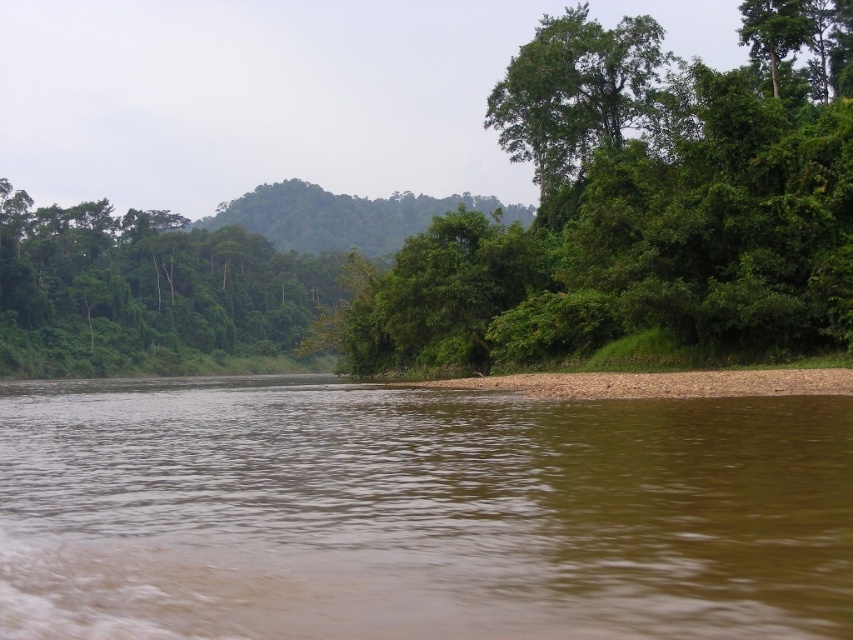
You are planning to plant a new tree in this landscape. The new tree will be placed between the green leafy tree at center and the green leafy tree at upper center. Considering their widths, which existing tree should the new tree be closer to in order to maintain a balanced spacing between all three trees?

The green leafy tree at center is wider than the green leafy tree at upper center. To maintain balanced spacing, the new tree should be placed closer to the wider tree, which is the green leafy tree at center, so that the distances between each tree are proportionally adjusted based on their widths.

You are a hiker standing at the bottom of the image. You want to reach the green leafy tree at center. Which direction should you move to get there?

The green leafy tree at center is located at point 0.322 on the x axis and 0.748 on the y axis. Since you are at the bottom of the image, you should move upward to reach it.

You are standing at the point labeled point (0, 563) and want to walk to the point labeled point (624, 272). Based on the scene description, which direction should you face to move towards your destination?

To move from point (0, 563) to point (624, 272), you should face towards the upper left direction since point (624, 272) is further away from the viewer compared to point (0, 563).